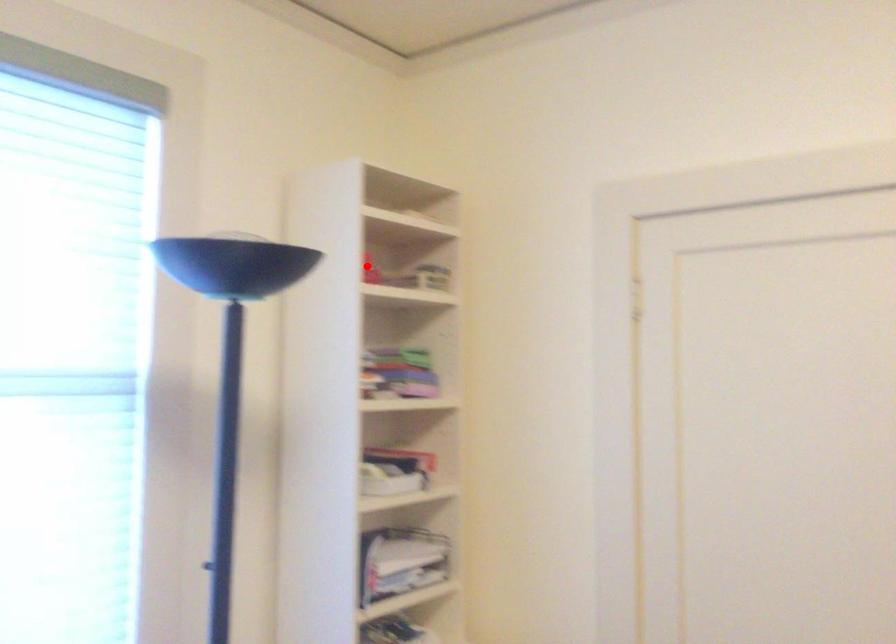
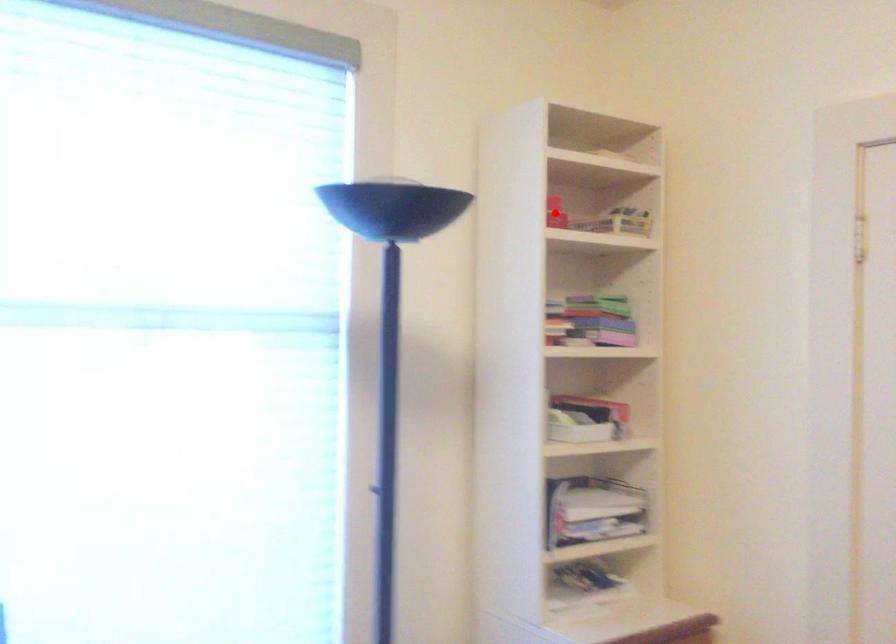
I am providing you with two images of the same scene from different viewpoints. A red point is marked on the first image and another point is marked on the second image. Are the points marked in image1 and image2 representing the same 3D position?

Yes